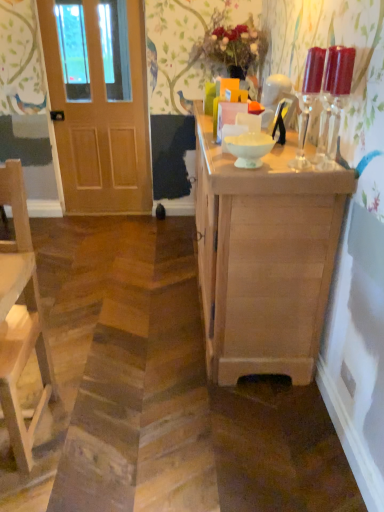
Where is `free point behind translucent glass candle holders at upper right, acting as the second candle holder starting from the left`? Image resolution: width=384 pixels, height=512 pixels. free point behind translucent glass candle holders at upper right, acting as the second candle holder starting from the left is located at coordinates (301, 155).